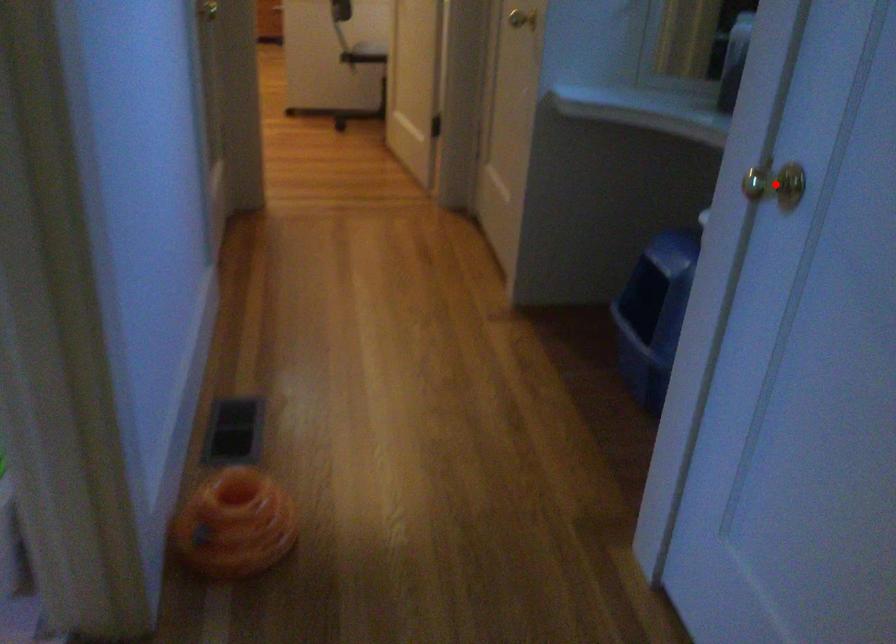
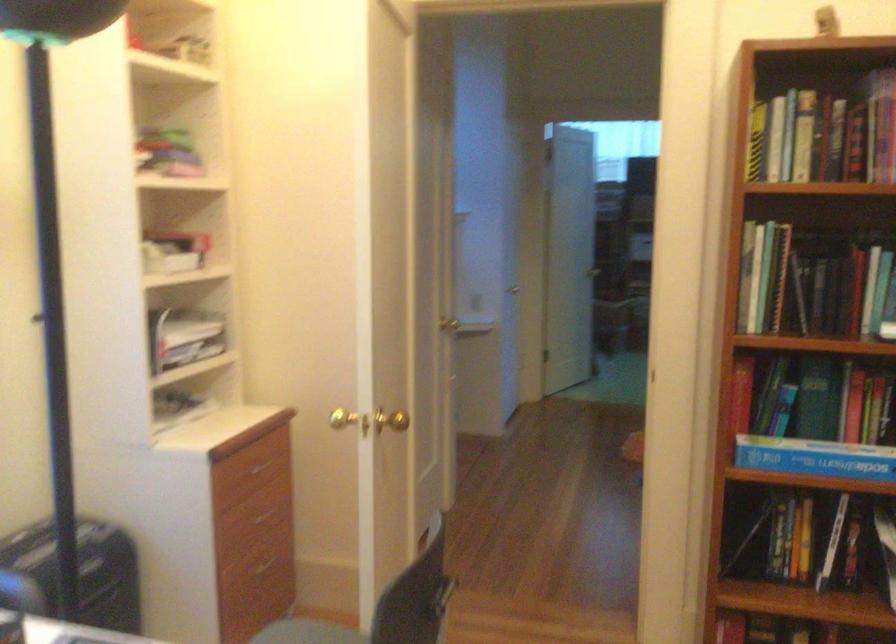
Question: I am providing you with two images of the same scene from different viewpoints. A red point is marked on the first image. Can you still see the location of the red point in image 2?

Choices:
 (A) Yes
 (B) No

Answer: (B)